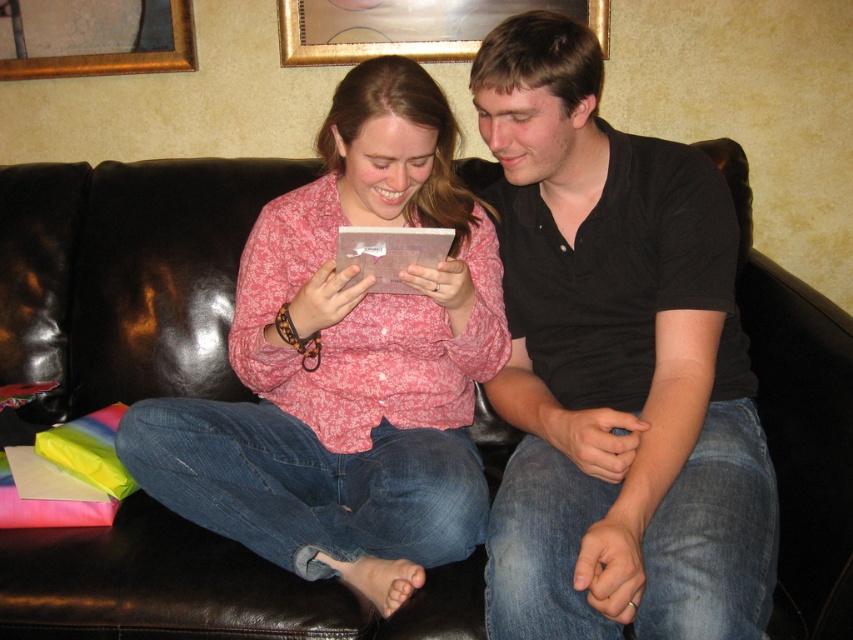
Is black cotton shirt at center to the left of pink floral shirt at center from the viewer's perspective?

In fact, black cotton shirt at center is to the right of pink floral shirt at center.

Consider the image. Does black cotton shirt at center have a lesser width compared to pink floral shirt at center?

Indeed, black cotton shirt at center has a lesser width compared to pink floral shirt at center.

Describe the element at coordinates (614, 368) in the screenshot. Image resolution: width=853 pixels, height=640 pixels. I see `black cotton shirt at center` at that location.

At what (x,y) coordinates should I click in order to perform the action: click on black cotton shirt at center. Please return your answer as a coordinate pair (x, y). Image resolution: width=853 pixels, height=640 pixels. Looking at the image, I should click on (614, 368).